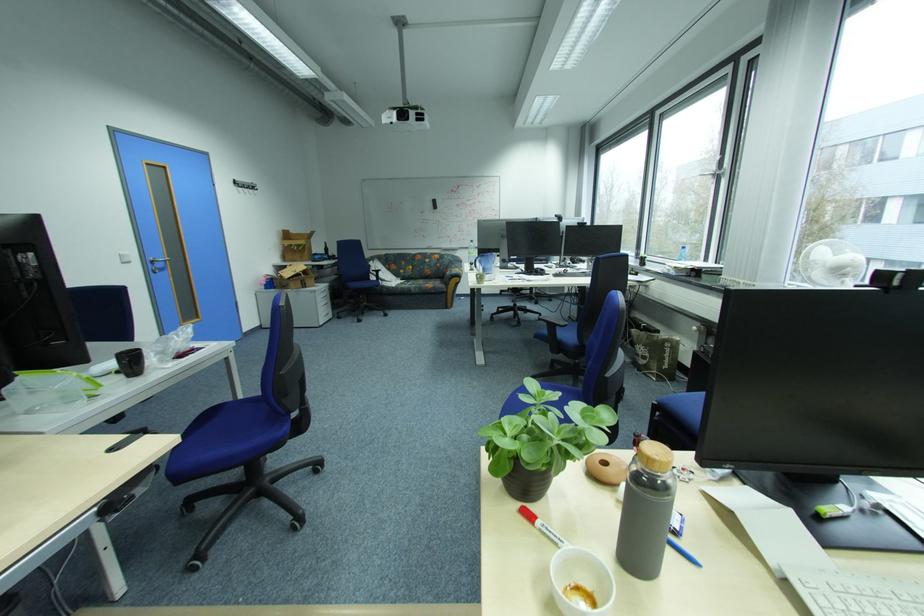
Identify the location of sofa sitting surface. (420, 284).